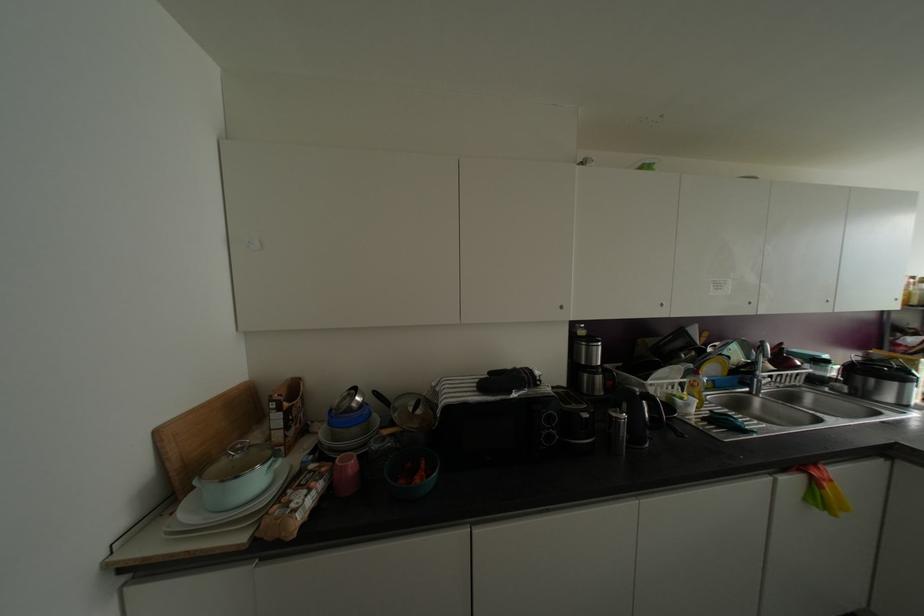
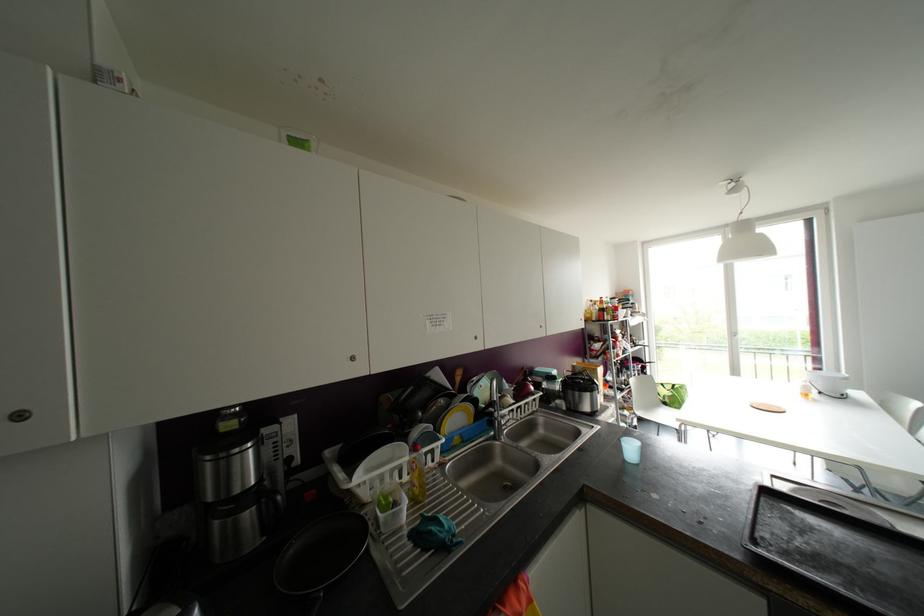
Find the pixel in the second image that matches pixel 661 304 in the first image.

(351, 358)